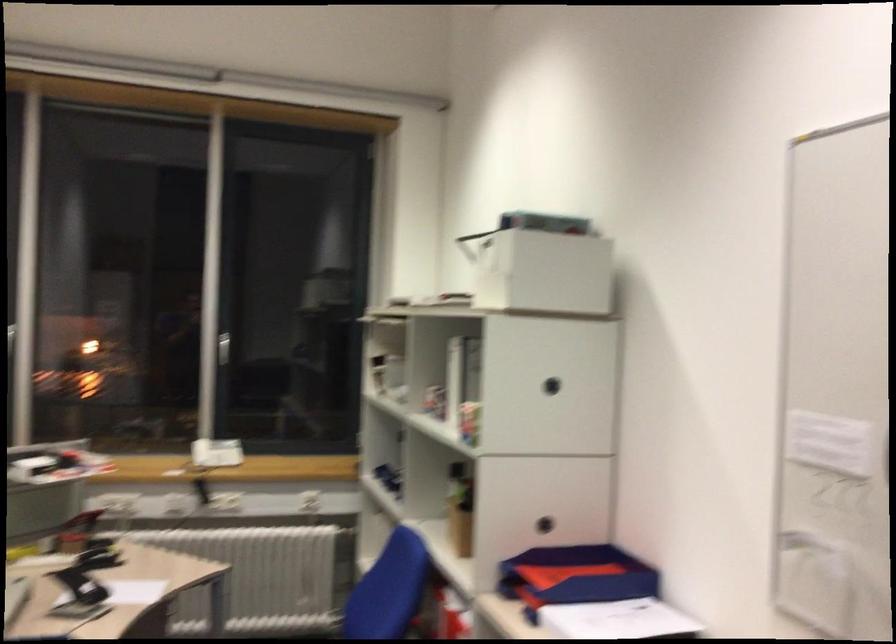
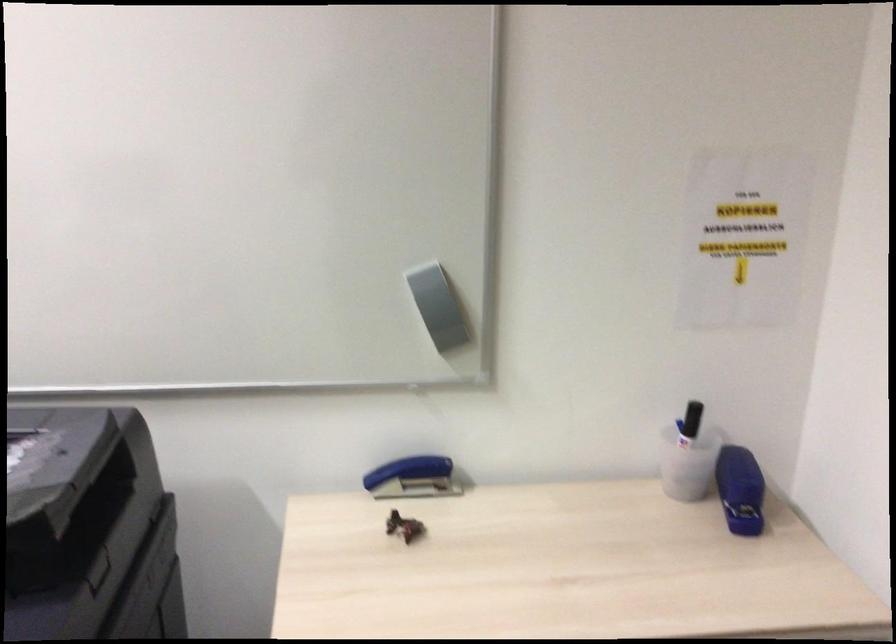
First-person continuous shooting, in which direction is the camera rotating?

The camera's rotation is toward right-down.